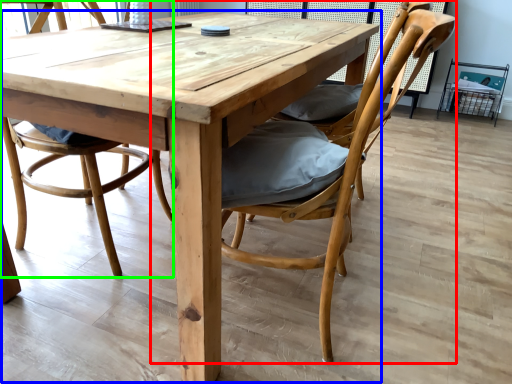
Question: Which object is positioned farthest from chair (highlighted by a red box)? Select from kitchen & dining room table (highlighted by a blue box) and chair (highlighted by a green box).

Choices:
 (A) kitchen & dining room table
 (B) chair

Answer: (B)